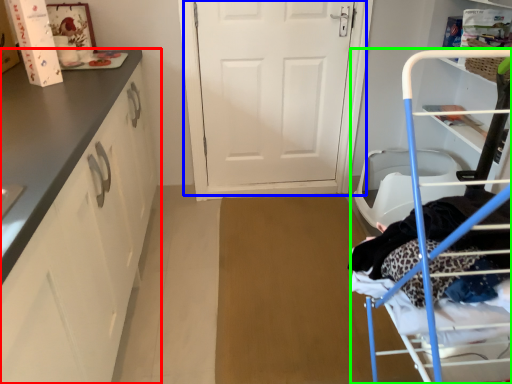
Question: Which is farther away from cabinetry (highlighted by a red box)? door (highlighted by a blue box) or furniture (highlighted by a green box)?

Choices:
 (A) door
 (B) furniture

Answer: (A)